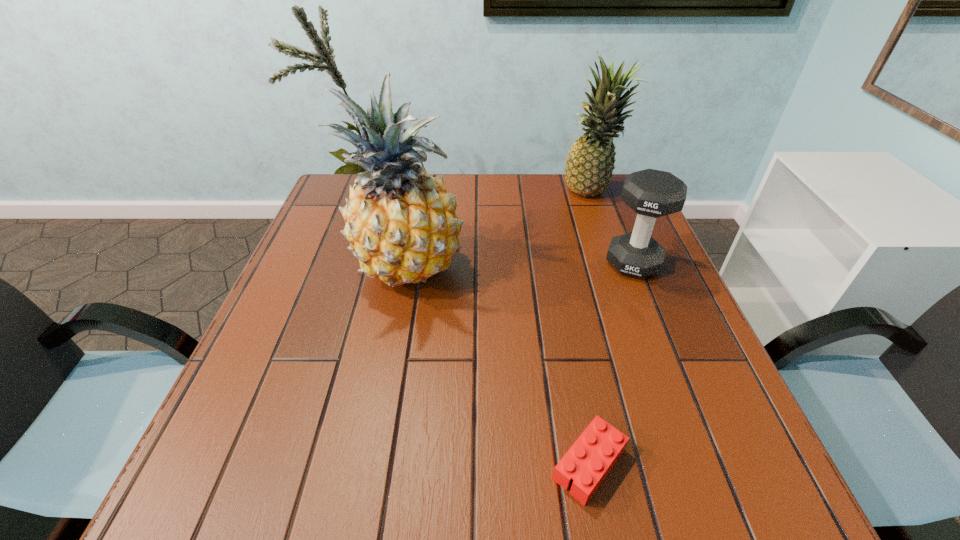
In the image, there is a desktop. Identify the location of vacant region at the right edge. The height and width of the screenshot is (540, 960). (649, 346).

Where is `vacant area at the far left corner of the desktop`? vacant area at the far left corner of the desktop is located at coordinates (330, 191).

Identify the location of free space at the near left corner. The height and width of the screenshot is (540, 960). [x=286, y=486].

Locate an element on the screen. The height and width of the screenshot is (540, 960). vacant space at the far right corner is located at coordinates (589, 211).

Locate an element on the screen. This screenshot has width=960, height=540. free space at the near right corner of the desktop is located at coordinates (717, 460).

The image size is (960, 540). In order to click on vacant space that is in between the right pineapple and the dumbbell in this screenshot , I will do `click(612, 228)`.

Find the location of a particular element. This screenshot has width=960, height=540. free space between the left pineapple and the second shortest object is located at coordinates 521,265.

Identify the location of vacant space that's between the farthest object and the leftmost object. (500, 230).

Where is `free space between the right pineapple and the leftmost object`? This screenshot has width=960, height=540. free space between the right pineapple and the leftmost object is located at coordinates (500, 230).

Where is `empty space that is in between the farther pineapple and the dumbbell`? Image resolution: width=960 pixels, height=540 pixels. empty space that is in between the farther pineapple and the dumbbell is located at coordinates (612, 228).